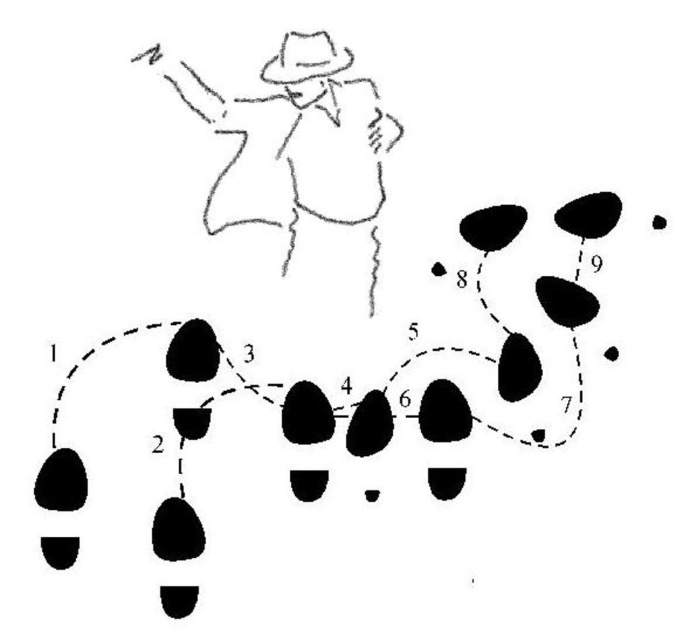
Can you confirm if black line drawing man at upper left is positioned above matte black cowboy hat at upper center?

No, black line drawing man at upper left is not above matte black cowboy hat at upper center.

Is black line drawing man at upper left behind matte black cowboy hat at upper center?

No, it is not.

The image size is (690, 640). What do you see at coordinates (297, 145) in the screenshot?
I see `black line drawing man at upper left` at bounding box center [297, 145].

I want to click on black line drawing man at upper left, so click(297, 145).

Can you confirm if black rubber footprints at lower left is thinner than matte black cowboy hat at upper center?

No.

What do you see at coordinates (444, 412) in the screenshot? This screenshot has width=690, height=640. I see `black rubber footprints at lower left` at bounding box center [444, 412].

Does point (571, 292) come in front of point (348, 58)?

No, (571, 292) is behind (348, 58).

The height and width of the screenshot is (640, 690). In order to click on black rubber footprints at lower left in this screenshot , I will do `click(444, 412)`.

In the scene shown: Can you confirm if black rubber footprints at lower left is smaller than black line drawing man at upper left?

Actually, black rubber footprints at lower left might be larger than black line drawing man at upper left.

Can you confirm if black rubber footprints at lower left is wider than black line drawing man at upper left?

Yes.

Who is more distant from viewer, (578, 372) or (255, 106)?

The point (578, 372) is more distant.

The image size is (690, 640). Identify the location of black rubber footprints at lower left. (444, 412).